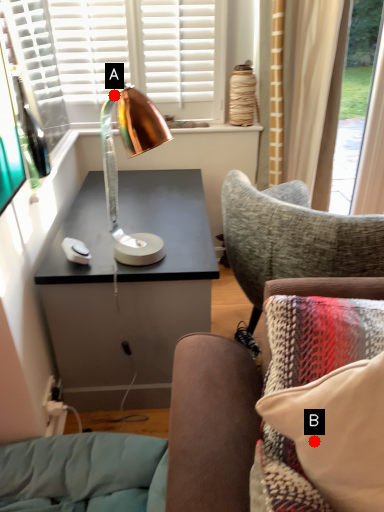
Question: Two points are circled on the image, labeled by A and B beside each circle. Which point is closer to the camera taking this photo?

Choices:
 (A) A is closer
 (B) B is closer

Answer: (B)